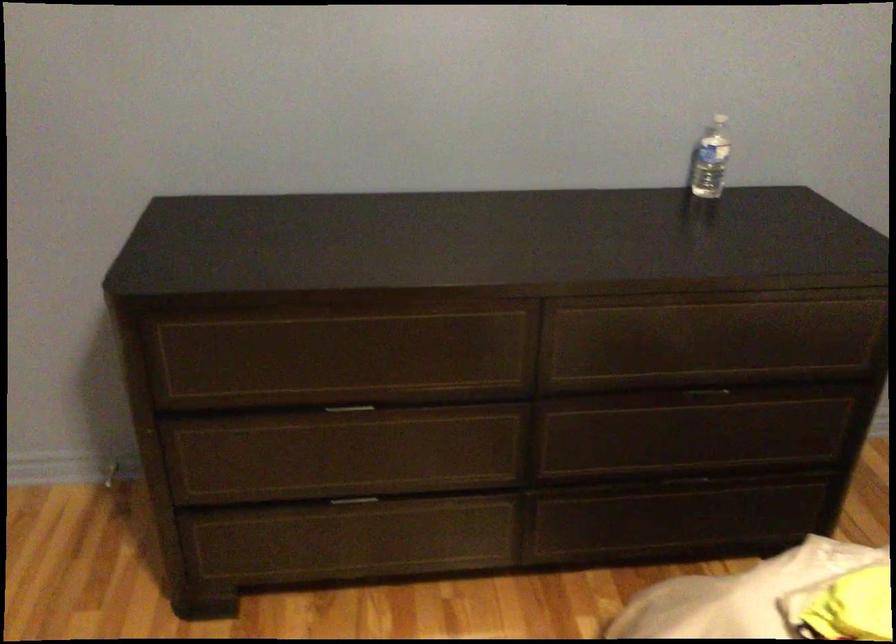
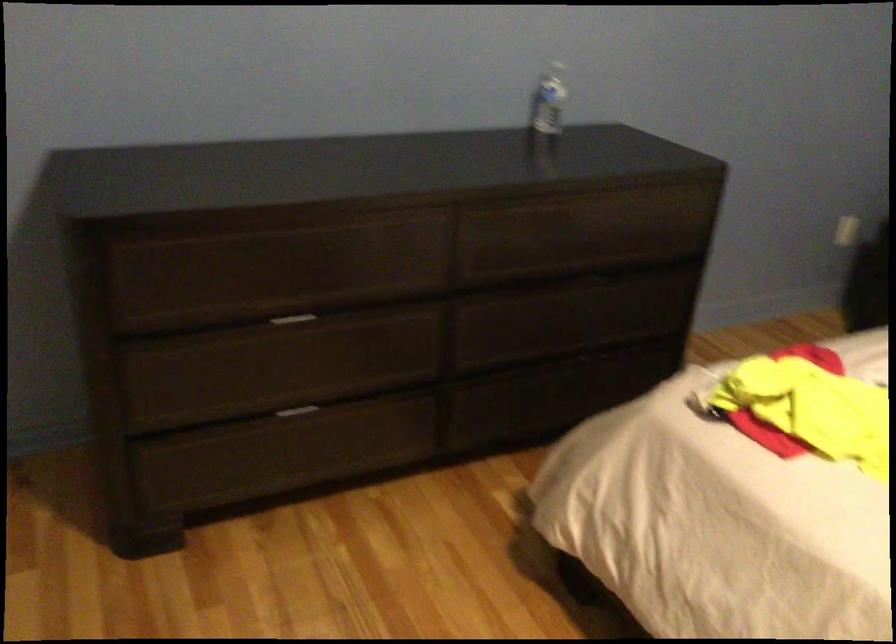
Question: The images are taken continuously from a first-person perspective. In which direction is your viewpoint rotating?

Choices:
 (A) Left
 (B) Right
 (C) Up
 (D) Down

Answer: (B)